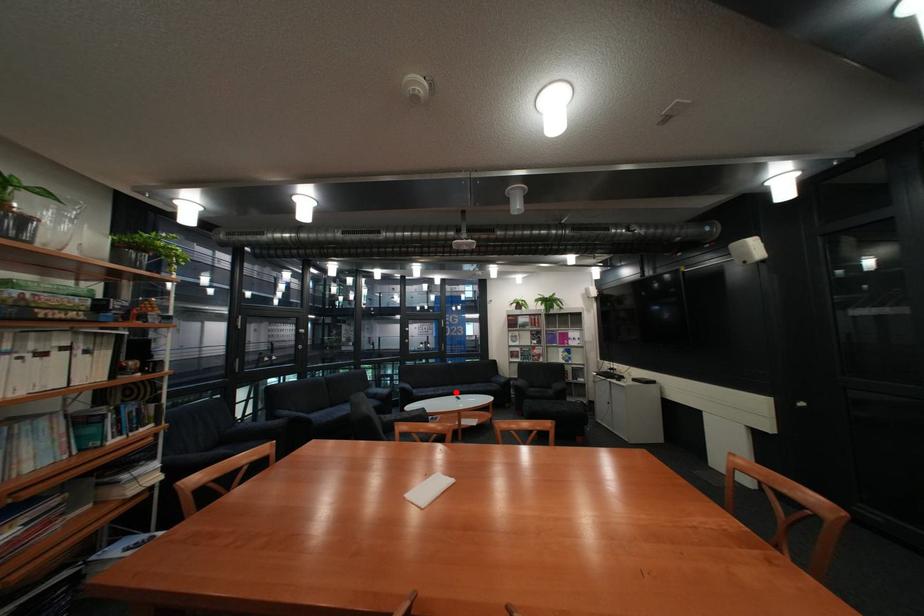
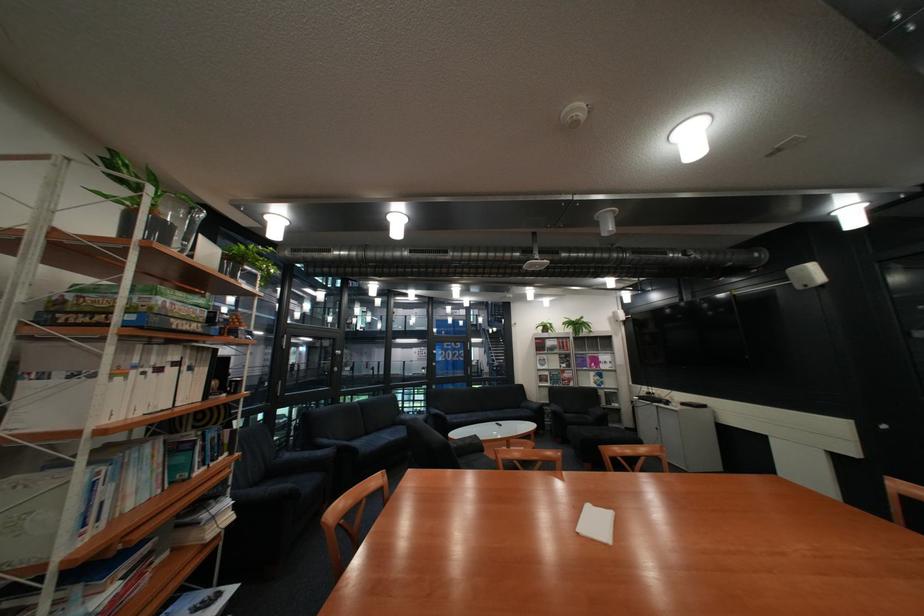
In the second image, find the point that corresponds to the highlighted location in the first image.

(490, 418)